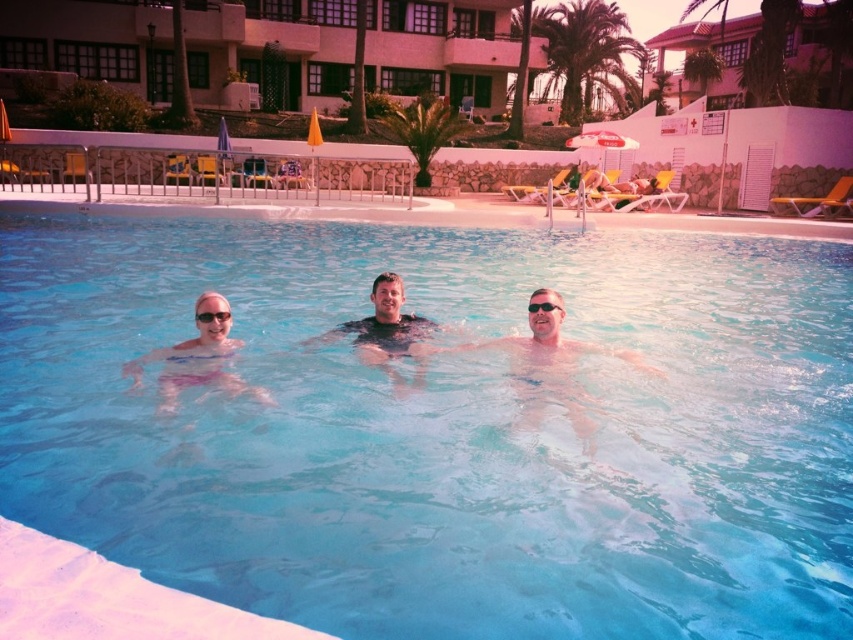
You are designing a storage container for items found in the pool area. The pink fabric at center and the clear plastic goggles at center need to be stored. Based on their sizes, which item requires a larger compartment?

The pink fabric at center requires a larger compartment because its width is larger than that of the clear plastic goggles at center.

Looking at this image, you are a swimmer who wants to retrieve an object from the pool. You see the pink fabric at center and the clear plastic goggles at center. Which object is closer to the bottom of the pool?

The pink fabric at center is positioned under clear plastic goggles at center, so the pink fabric at center is closer to the bottom of the pool.